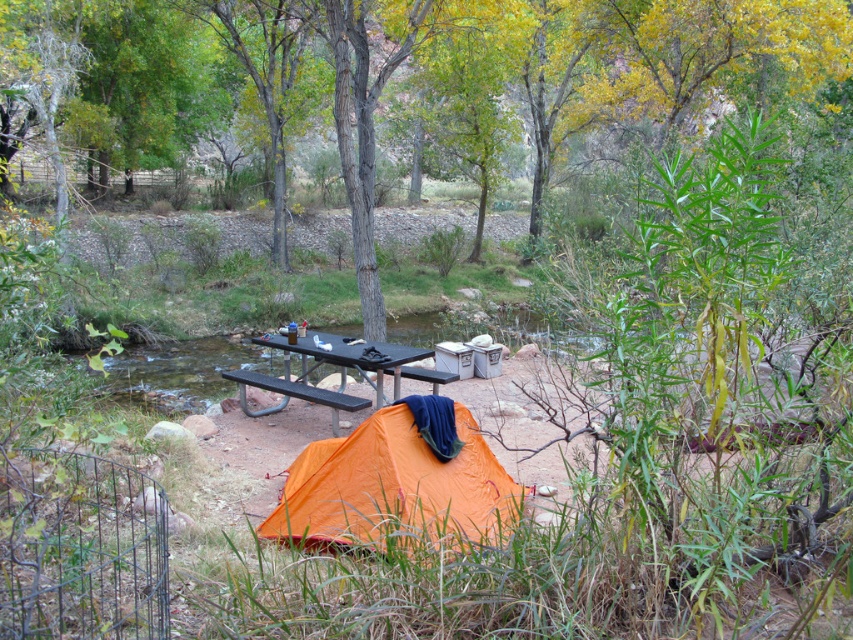
Question: Can you confirm if green leafy tree at center is positioned above black metal picnic table at center?

Choices:
 (A) yes
 (B) no

Answer: (A)

Question: Is orange nylon tent at lower center wider than black metal picnic table at center?

Choices:
 (A) yes
 (B) no

Answer: (B)

Question: Which object appears closest to the camera in this image?

Choices:
 (A) green leafy tree at center
 (B) black metal picnic table at center

Answer: (B)

Question: Estimate the real-world distances between objects in this image. Which object is closer to the orange nylon tent at lower center?

Choices:
 (A) black metal picnic table at center
 (B) green leafy tree at center

Answer: (A)

Question: Can you confirm if green leafy tree at center is positioned below orange nylon tent at lower center?

Choices:
 (A) yes
 (B) no

Answer: (B)

Question: Based on their relative distances, which object is farther from the orange nylon tent at lower center?

Choices:
 (A) black metal picnic table at center
 (B) green leafy tree at center

Answer: (B)